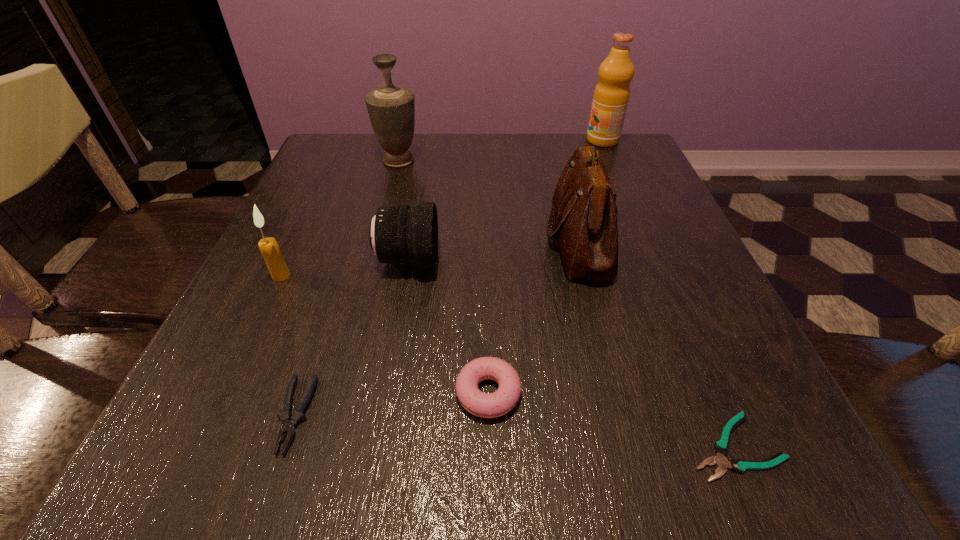
At what (x,y) coordinates should I click in order to perform the action: click on fruit juice. Please return your answer as a coordinate pair (x, y). Image resolution: width=960 pixels, height=540 pixels. Looking at the image, I should click on (611, 95).

The image size is (960, 540). I want to click on urn, so click(391, 109).

What are the coordinates of `the sixth object from left to right` in the screenshot? It's located at (584, 212).

The width and height of the screenshot is (960, 540). I want to click on shoulder bag, so click(x=584, y=212).

Where is `the leftmost object`? The width and height of the screenshot is (960, 540). the leftmost object is located at coordinates (269, 247).

The width and height of the screenshot is (960, 540). What are the coordinates of `candle` in the screenshot? It's located at (269, 247).

This screenshot has height=540, width=960. Identify the location of telephoto lens. (397, 234).

Where is `doughnut`? This screenshot has width=960, height=540. doughnut is located at coordinates (486, 405).

The width and height of the screenshot is (960, 540). I want to click on the fifth object from left to right, so click(486, 405).

At what (x,y) coordinates should I click in order to perform the action: click on the seventh tallest object. Please return your answer as a coordinate pair (x, y). The width and height of the screenshot is (960, 540). Looking at the image, I should click on (289, 421).